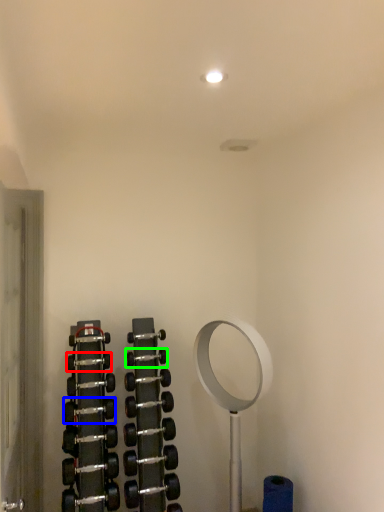
Question: Which object is positioned closest to dumbbell (highlighted by a red box)? Select from dumbbell (highlighted by a blue box) and dumbbell (highlighted by a green box).

Choices:
 (A) dumbbell
 (B) dumbbell

Answer: (B)